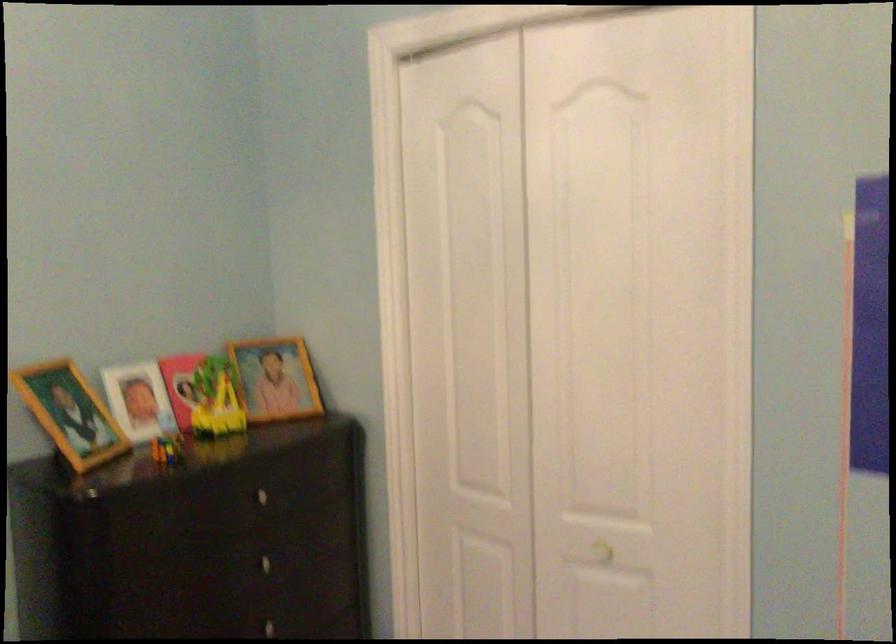
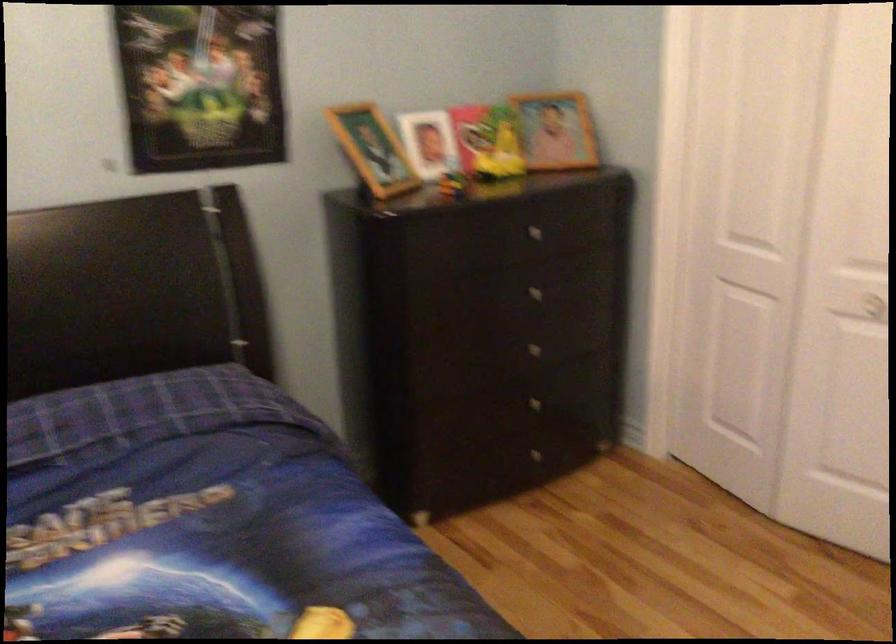
Find the pixel in the second image that matches pixel 593 554 in the first image.

(864, 305)